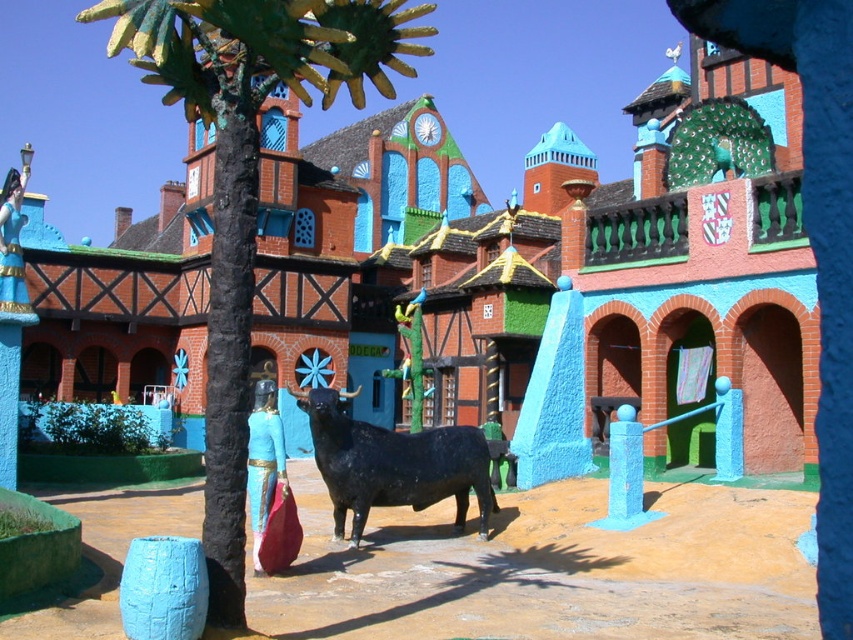
You are designing a new path for visitors in this themed area. The path must allow visitors to walk around both the green painted wood palm tree at center and the black matte bull at center. Considering their sizes, which object will require a wider path to accommodate its size?

The green painted wood palm tree at center is larger in size than the black matte bull at center, so the path around the green painted wood palm tree at center will need to be wider to accommodate its larger size.

You are a visitor in this themed park and want to take a photo with the green painted wood palm tree at center. There are two figures dressed in traditional attire nearby. How far apart are the two figures from each other?

The two figures are 106.07 feet apart from each other.